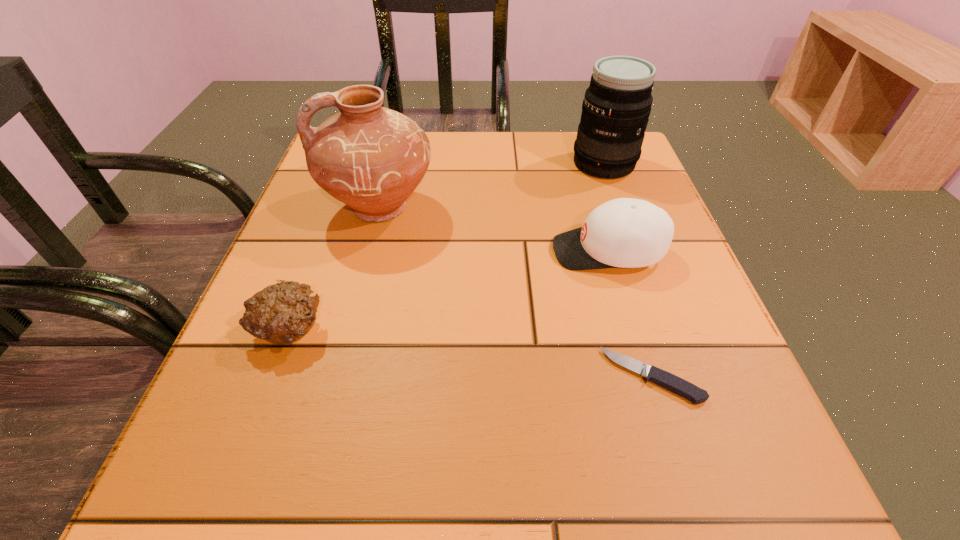
I want to click on vacant space located 0.050m on the right of the muffin, so click(x=357, y=329).

Locate an element on the screen. The height and width of the screenshot is (540, 960). free spot located on the front of the shortest object is located at coordinates (694, 514).

The height and width of the screenshot is (540, 960). What are the coordinates of `pottery situated at the far edge` in the screenshot? It's located at (371, 158).

This screenshot has width=960, height=540. I want to click on telephoto lens located at the far edge, so click(617, 104).

Identify the location of pottery positioned at the left edge. (371, 158).

Locate an element on the screen. This screenshot has width=960, height=540. muffin at the left edge is located at coordinates (282, 313).

Find the location of a particular element. telephoto lens that is positioned at the right edge is located at coordinates (617, 104).

Identify the location of baseball cap that is at the right edge. The image size is (960, 540). (625, 232).

I want to click on steak knife situated at the right edge, so click(669, 381).

I want to click on object that is positioned at the far left corner, so click(371, 158).